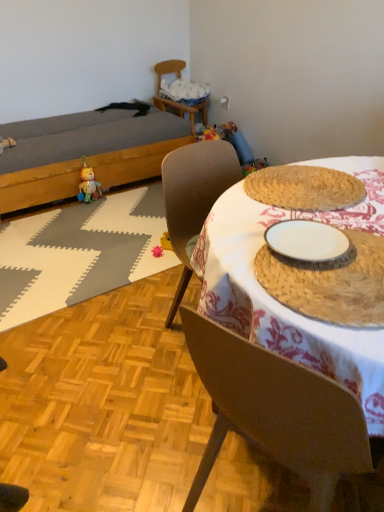
The image size is (384, 512). I want to click on free space that is in between plush yellow bear at lower left, the second toy from the right, and pink rubber toy at center, the second toy positioned from the left, so click(x=119, y=222).